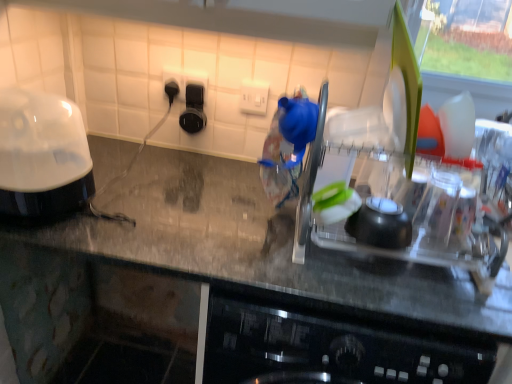
Question: Is white plastic electric outlet at center, placed as the first electric outlet when sorted from right to left, to the right of transparent plastic dish rack at center from the viewer's perspective?

Choices:
 (A) yes
 (B) no

Answer: (B)

Question: Is white plastic electric outlet at center, which is counted as the 2th electric outlet, starting from the left, aimed at transparent plastic dish rack at center?

Choices:
 (A) yes
 (B) no

Answer: (B)

Question: Is white plastic electric outlet at center, which is counted as the 2th electric outlet, starting from the left, not inside transparent plastic dish rack at center?

Choices:
 (A) no
 (B) yes

Answer: (B)

Question: Is white plastic electric outlet at center, placed as the first electric outlet when sorted from right to left, in contact with transparent plastic dish rack at center?

Choices:
 (A) yes
 (B) no

Answer: (B)

Question: Are white plastic electric outlet at center, placed as the first electric outlet when sorted from right to left, and transparent plastic dish rack at center far apart?

Choices:
 (A) no
 (B) yes

Answer: (A)

Question: Is transparent plastic dish rack at center at the back of white plastic electric outlet at center, which is counted as the 2th electric outlet, starting from the left?

Choices:
 (A) no
 (B) yes

Answer: (A)

Question: Is black plastic outlet at upper center, the second electric outlet viewed from the right, positioned far away from clear plastic dish rack at center?

Choices:
 (A) yes
 (B) no

Answer: (B)

Question: Does black plastic outlet at upper center, which ranks as the first electric outlet in left-to-right order, appear on the left side of clear plastic dish rack at center?

Choices:
 (A) yes
 (B) no

Answer: (A)

Question: From the image's perspective, is black plastic outlet at upper center, the second electric outlet viewed from the right, on top of clear plastic dish rack at center?

Choices:
 (A) no
 (B) yes

Answer: (B)

Question: From the image's perspective, is black plastic outlet at upper center, which ranks as the first electric outlet in left-to-right order, located beneath clear plastic dish rack at center?

Choices:
 (A) yes
 (B) no

Answer: (B)

Question: Can you confirm if black plastic outlet at upper center, the second electric outlet viewed from the right, is wider than clear plastic dish rack at center?

Choices:
 (A) no
 (B) yes

Answer: (A)

Question: Is black plastic outlet at upper center, the second electric outlet viewed from the right, oriented towards clear plastic dish rack at center?

Choices:
 (A) no
 (B) yes

Answer: (A)

Question: Is black plastic outlet at upper center, the second electric outlet viewed from the right, taller than transparent plastic dish rack at center?

Choices:
 (A) no
 (B) yes

Answer: (A)